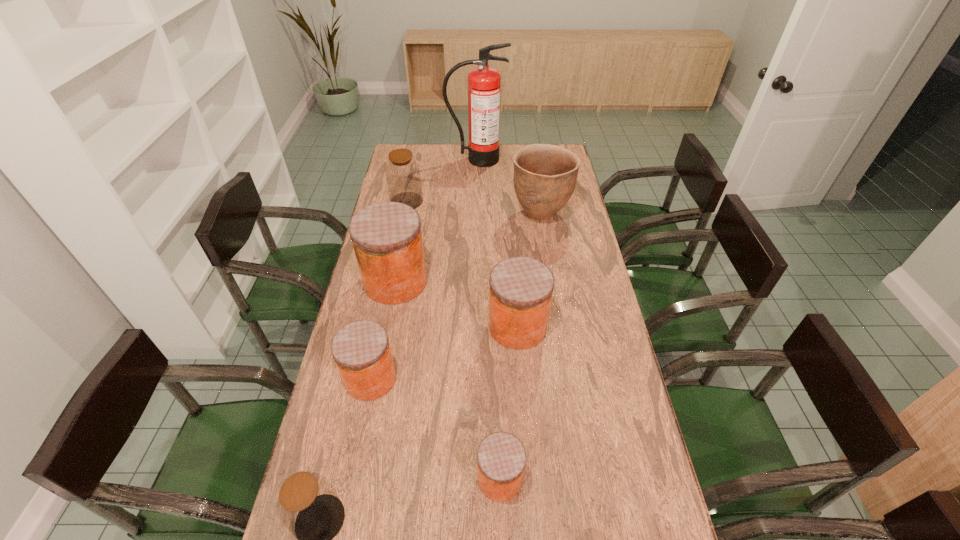
Locate an element on the screen. This screenshot has height=540, width=960. vacant position at the right edge of the desktop is located at coordinates (614, 524).

The width and height of the screenshot is (960, 540). I want to click on free space at the far left corner of the desktop, so click(x=421, y=145).

Locate an element on the screen. empty location between the pottery and the tallest jar is located at coordinates (468, 248).

Where is `free space between the second nearest orange jar and the second biggest orange jar`? The image size is (960, 540). free space between the second nearest orange jar and the second biggest orange jar is located at coordinates (444, 353).

Where is `free spot between the nearest orange jar and the red fire extinguisher`? free spot between the nearest orange jar and the red fire extinguisher is located at coordinates (488, 319).

You are a GUI agent. You are given a task and a screenshot of the screen. Output one action in this format:
    pyautogui.click(x=<x>, y=<y>)
    Task: Click on the empty space between the second biggest orange jar and the farther brown jar
    Image resolution: width=960 pixels, height=540 pixels.
    Given the screenshot: What is the action you would take?
    pyautogui.click(x=462, y=264)

Locate which object is the sixth closest to the farthest jar. Please provide its 2D coordinates. Your answer should be formatted as a tuple, i.e. [(x, y)], where the tuple contains the x and y coordinates of a point satisfying the conditions above.

[(501, 457)]

Where is `object that stands as the fourth closest to the bigger brown jar`? The width and height of the screenshot is (960, 540). object that stands as the fourth closest to the bigger brown jar is located at coordinates (520, 293).

Locate an element on the screen. The image size is (960, 540). the second closest jar to the tallest jar is located at coordinates (520, 293).

Select which jar is the closest to the pottery. Please provide its 2D coordinates. Your answer should be formatted as a tuple, i.e. [(x, y)], where the tuple contains the x and y coordinates of a point satisfying the conditions above.

[(387, 239)]